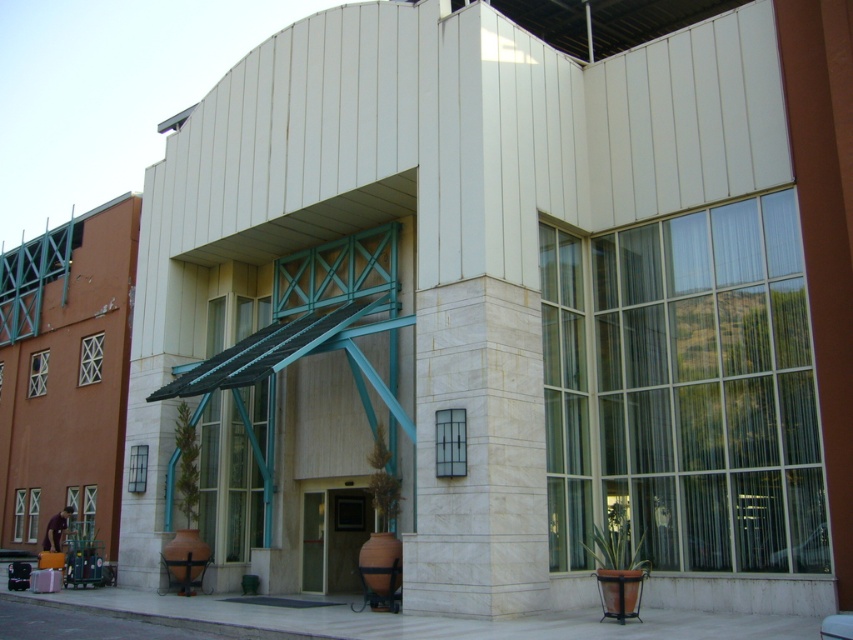
Where is `white marble pillar at center`? The height and width of the screenshot is (640, 853). white marble pillar at center is located at coordinates (479, 452).

Which is behind, point (451, 524) or point (310, 524)?

Positioned behind is point (310, 524).

Identify the location of white marble pillar at center. (479, 452).